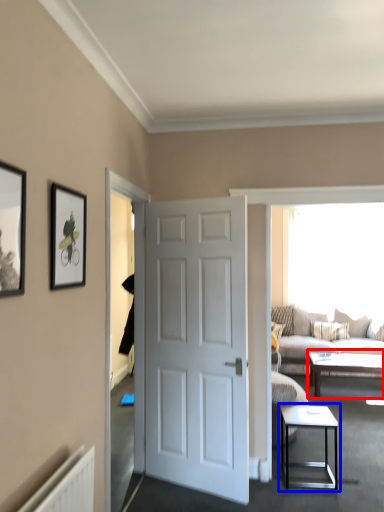
Question: Which object is further to the camera taking this photo, coffee table (highlighted by a red box) or table (highlighted by a blue box)?

Choices:
 (A) coffee table
 (B) table

Answer: (A)